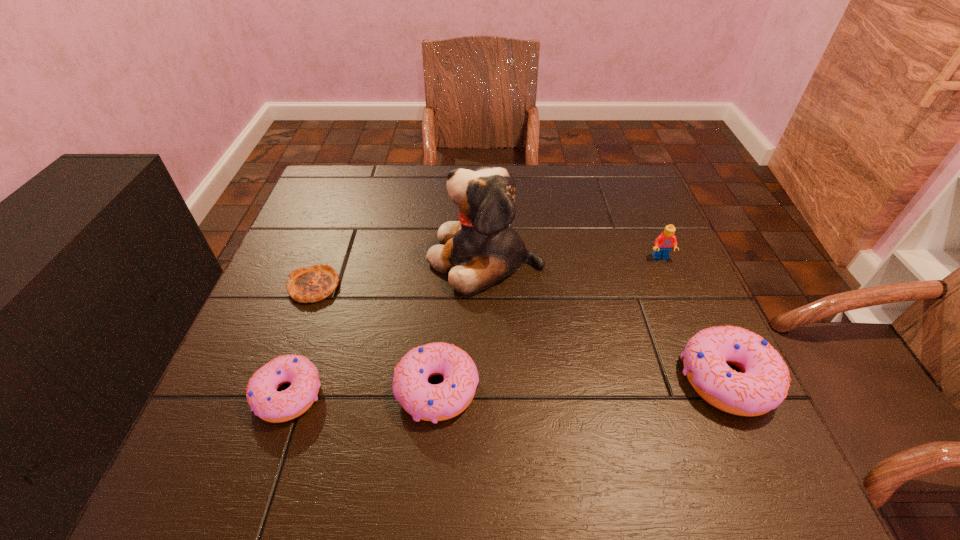
The width and height of the screenshot is (960, 540). In order to click on free location located 0.360m on the back of the rightmost doughnut in this screenshot , I will do `click(659, 228)`.

Identify the location of vacant region located 0.260m at the face of the puppy. Image resolution: width=960 pixels, height=540 pixels. (319, 258).

The width and height of the screenshot is (960, 540). What are the coordinates of `vacant area situated at the face of the puppy` in the screenshot? It's located at (x=398, y=258).

Identify the location of free space located at the face of the puppy. (294, 258).

At what (x,y) coordinates should I click in order to perform the action: click on blank area located on the right of the shortest object. Please return your answer as a coordinate pair (x, y). Image resolution: width=960 pixels, height=540 pixels. Looking at the image, I should click on (419, 286).

Locate an element on the screen. vacant space positioned on the face of the Lego is located at coordinates (719, 393).

Locate an element on the screen. The width and height of the screenshot is (960, 540). doughnut at the left edge is located at coordinates (263, 398).

Where is `quiche located in the left edge section of the desktop`? The image size is (960, 540). quiche located in the left edge section of the desktop is located at coordinates (313, 283).

Find the location of `doughnut located in the right edge section of the desktop`. doughnut located in the right edge section of the desktop is located at coordinates (762, 386).

Identify the location of Lego that is positioned at the right edge. The image size is (960, 540). (665, 241).